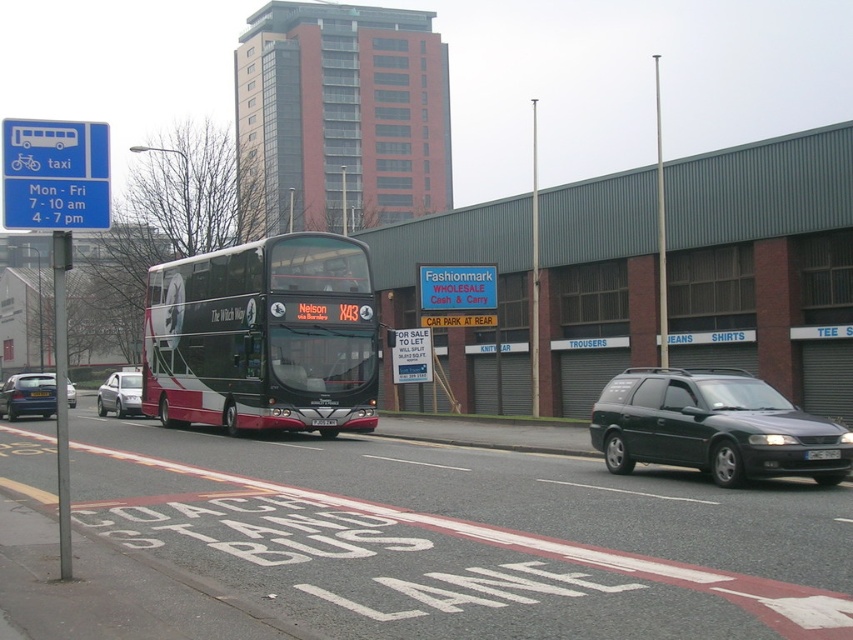
Question: Can you confirm if blue plastic sign at upper left is positioned to the left of white plastic license plate at center?

Choices:
 (A) yes
 (B) no

Answer: (A)

Question: Among these objects, which one is nearest to the camera?

Choices:
 (A) black metallic bus at center
 (B) silver metallic sedan at center-left
 (C) matte black station wagon at right

Answer: (C)

Question: Is matte black station wagon at right bigger than matte black car at lower left?

Choices:
 (A) yes
 (B) no

Answer: (B)

Question: Where is black metallic bus at center located in relation to yellow plastic license plate at center in the image?

Choices:
 (A) below
 (B) above

Answer: (B)

Question: Among these points, which one is nearest to the camera?

Choices:
 (A) (131, 380)
 (B) (833, 451)

Answer: (B)

Question: Which point is closer to the camera?

Choices:
 (A) matte black car at lower left
 (B) black metallic bus at center
 (C) blue plastic sign at upper left
 (D) white plastic license plate at center

Answer: (C)